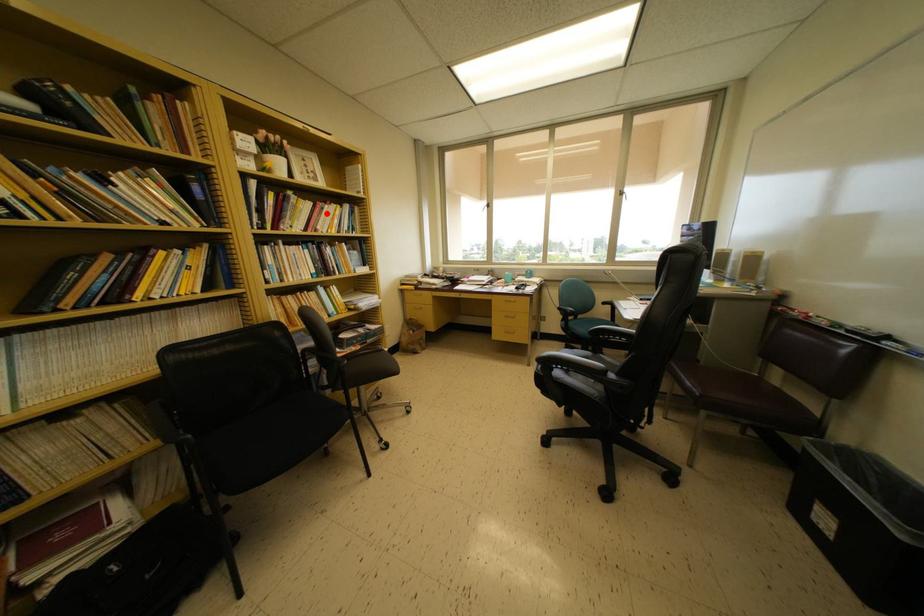
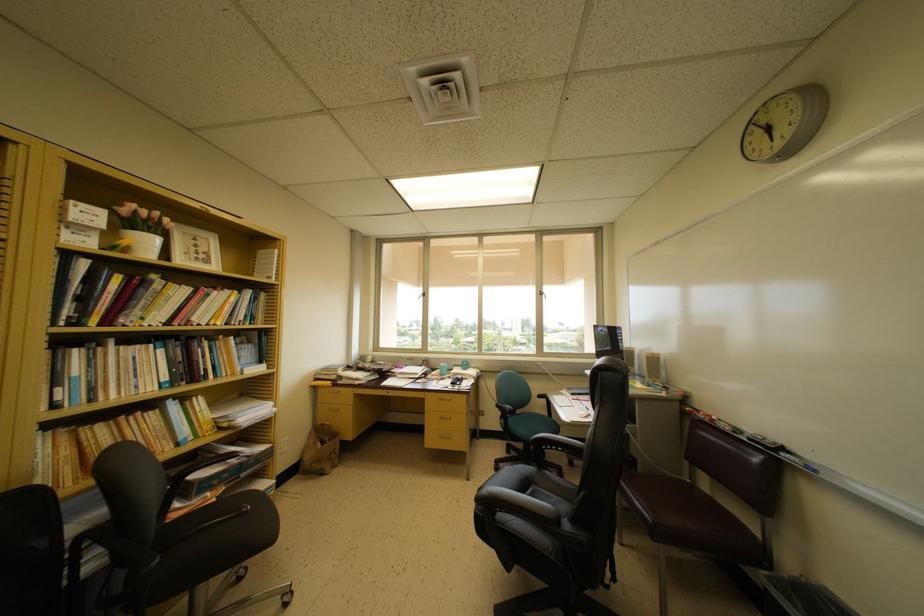
Where in the second image is the point corresponding to the highlighted location from the first image?

(213, 300)